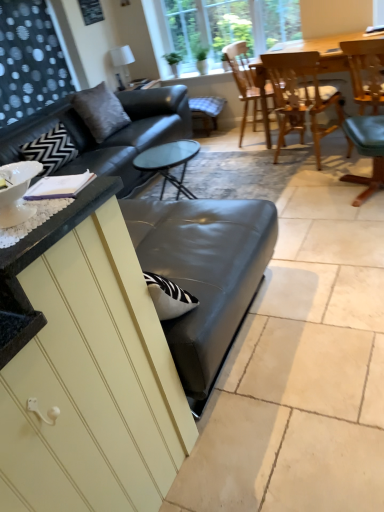
Measure the distance between wooden chair at upper right, which is the 2th chair from right to left, and camera.

9.44 feet.

This screenshot has height=512, width=384. I want to click on checkered fabric bar stool at center, so click(207, 110).

Describe the element at coordinates (229, 27) in the screenshot. I see `clear glass window at upper center` at that location.

You are a GUI agent. You are given a task and a screenshot of the screen. Output one action in this format:
    pyautogui.click(x=<x>, y=<y>)
    Task: Click on the wooden chair at upper right, which ranks as the third chair in left-to-right order
    This screenshot has height=512, width=384.
    Given the screenshot: What is the action you would take?
    pyautogui.click(x=365, y=106)

You are a GUI agent. You are given a task and a screenshot of the screen. Output one action in this format:
    pyautogui.click(x=<x>, y=<y>)
    Task: Click on the wooden chair at upper right, which is the 2th chair from right to left
    
    Given the screenshot: What is the action you would take?
    pyautogui.click(x=301, y=96)

Does clear glass window at upper center come in front of wooden chair at upper right, which is counted as the 2th chair, starting from the left?

That is False.

Is clear glass window at upper center oriented towards wooden chair at upper right, which is the 2th chair from right to left?

Yes, clear glass window at upper center is oriented towards wooden chair at upper right, which is the 2th chair from right to left.

Are clear glass window at upper center and wooden chair at upper right, which is counted as the 2th chair, starting from the left, making contact?

No, clear glass window at upper center is not beside wooden chair at upper right, which is counted as the 2th chair, starting from the left.

From the image's perspective, is clear glass window at upper center on wooden chair at upper right, which is counted as the 2th chair, starting from the left?

Yes.

Considering the positions of point (295, 60) and point (86, 93), is point (295, 60) closer or farther from the camera than point (86, 93)?

Point (295, 60) is closer to the camera than point (86, 93).

In the scene shown: Considering the sizes of wooden chair at upper right, which is counted as the 2th chair, starting from the left, and gray fabric pillow at upper left in the image, is wooden chair at upper right, which is counted as the 2th chair, starting from the left, bigger or smaller than gray fabric pillow at upper left?

Considering their sizes, wooden chair at upper right, which is counted as the 2th chair, starting from the left, takes up more space than gray fabric pillow at upper left.

How distant is wooden chair at upper right, which is counted as the 2th chair, starting from the left, from gray fabric pillow at upper left?

wooden chair at upper right, which is counted as the 2th chair, starting from the left, and gray fabric pillow at upper left are 4.67 feet apart from each other.

Is wooden chair at upper right, which is counted as the 2th chair, starting from the left, closer to camera compared to gray fabric pillow at upper left?

Yes, wooden chair at upper right, which is counted as the 2th chair, starting from the left, is closer to the viewer.

Based on the photo, what's the angular difference between wooden chair at upper center, the first chair when ordered from left to right, and wooden chair at upper right, which is the 2th chair from right to left,'s facing directions?

They differ by 74.1 degrees in their facing directions.

Is wooden chair at upper center, the first chair when ordered from left to right, not within wooden chair at upper right, which is counted as the 2th chair, starting from the left?

Yes.

Considering the sizes of objects wooden chair at upper center, the first chair when ordered from left to right, and wooden chair at upper right, which is counted as the 2th chair, starting from the left, in the image provided, who is thinner, wooden chair at upper center, the first chair when ordered from left to right, or wooden chair at upper right, which is counted as the 2th chair, starting from the left,?

Thinner between the two is wooden chair at upper center, the first chair when ordered from left to right.

Is wooden chair at upper center, which is the third chair in right-to-left order, closer to the viewer compared to wooden chair at upper right, which is the 2th chair from right to left?

No, it is not.

Is wooden chair at upper center, which is the third chair in right-to-left order, oriented away from gray fabric pillow at upper left?

That's not correct — wooden chair at upper center, which is the third chair in right-to-left order, is not looking away from gray fabric pillow at upper left.

From a real-world perspective, is wooden chair at upper center, the first chair when ordered from left to right, physically located above or below gray fabric pillow at upper left?

From a real-world perspective, wooden chair at upper center, the first chair when ordered from left to right, is physically below gray fabric pillow at upper left.

Is wooden chair at upper center, the first chair when ordered from left to right, touching gray fabric pillow at upper left?

There is a gap between wooden chair at upper center, the first chair when ordered from left to right, and gray fabric pillow at upper left.

Between wooden chair at upper center, the first chair when ordered from left to right, and gray fabric pillow at upper left, which one is positioned behind?

wooden chair at upper center, the first chair when ordered from left to right, is further away from the camera.

Does gray fabric pillow at upper left contain wooden chair at upper right, marked as the first chair in a right-to-left arrangement?

Definitely not — wooden chair at upper right, marked as the first chair in a right-to-left arrangement, is not inside gray fabric pillow at upper left.

Considering the relative positions of gray fabric pillow at upper left and wooden chair at upper right, marked as the first chair in a right-to-left arrangement, in the image provided, is gray fabric pillow at upper left to the left or to the right of wooden chair at upper right, marked as the first chair in a right-to-left arrangement,?

gray fabric pillow at upper left is to the left of wooden chair at upper right, marked as the first chair in a right-to-left arrangement.

From a real-world perspective, who is located lower, gray fabric pillow at upper left or wooden chair at upper right, marked as the first chair in a right-to-left arrangement?

wooden chair at upper right, marked as the first chair in a right-to-left arrangement.

Consider the image. Is gray fabric pillow at upper left taller than wooden chair at upper right, which ranks as the third chair in left-to-right order?

No, gray fabric pillow at upper left is not taller than wooden chair at upper right, which ranks as the third chair in left-to-right order.

How many degrees apart are the facing directions of clear glass window at upper center and wooden chair at upper center, which is the third chair in right-to-left order?

87.5 degrees.

The height and width of the screenshot is (512, 384). I want to click on the 1st chair to the right of the clear glass window at upper center, starting your count from the anchor, so click(249, 85).

Is clear glass window at upper center taller or shorter than wooden chair at upper center, the first chair when ordered from left to right?

Clearly, clear glass window at upper center is shorter compared to wooden chair at upper center, the first chair when ordered from left to right.

How distant is clear glass window at upper center from wooden chair at upper center, which is the third chair in right-to-left order?

clear glass window at upper center is 15.62 inches from wooden chair at upper center, which is the third chair in right-to-left order.

Which is more to the left, checkered fabric bar stool at center or wooden chair at upper center, the first chair when ordered from left to right?

checkered fabric bar stool at center.

Is checkered fabric bar stool at center oriented away from wooden chair at upper center, the first chair when ordered from left to right?

No, wooden chair at upper center, the first chair when ordered from left to right, is not at the back of checkered fabric bar stool at center.

Considering the sizes of objects checkered fabric bar stool at center and wooden chair at upper center, which is the third chair in right-to-left order, in the image provided, who is thinner, checkered fabric bar stool at center or wooden chair at upper center, which is the third chair in right-to-left order,?

Thinner between the two is checkered fabric bar stool at center.

At what (x,y) coordinates should I click in order to perform the action: click on window above the wooden chair at upper right, which is counted as the 2th chair, starting from the left (from the image's perspective). Please return your answer as a coordinate pair (x, y). The height and width of the screenshot is (512, 384). Looking at the image, I should click on (229, 27).

Locate an element on the screen. The height and width of the screenshot is (512, 384). pillow on the left of wooden chair at upper right, which is the 2th chair from right to left is located at coordinates 100,111.

Based on their spatial positions, is clear glass window at upper center or checkered fabric bar stool at center further from wooden chair at upper center, the first chair when ordered from left to right?

Among the two, checkered fabric bar stool at center is located further to wooden chair at upper center, the first chair when ordered from left to right.

Considering their positions, is gray fabric pillow at upper left positioned closer to wooden chair at upper right, which ranks as the third chair in left-to-right order, than wooden chair at upper right, which is the 2th chair from right to left?

wooden chair at upper right, which is the 2th chair from right to left, is closer to wooden chair at upper right, which ranks as the third chair in left-to-right order.

Estimate the real-world distances between objects in this image. Which object is closer to wooden chair at upper right, which ranks as the third chair in left-to-right order, clear glass window at upper center or wooden chair at upper center, which is the third chair in right-to-left order?

wooden chair at upper center, which is the third chair in right-to-left order, lies closer to wooden chair at upper right, which ranks as the third chair in left-to-right order, than the other object.

Looking at this image, when comparing their distances from checkered fabric bar stool at center, does wooden chair at upper right, which ranks as the third chair in left-to-right order, or wooden chair at upper right, which is the 2th chair from right to left, seem further?

Among the two, wooden chair at upper right, which ranks as the third chair in left-to-right order, is located further to checkered fabric bar stool at center.

Based on their spatial positions, is checkered fabric bar stool at center or gray fabric pillow at upper left further from wooden chair at upper right, marked as the first chair in a right-to-left arrangement?

The object further to wooden chair at upper right, marked as the first chair in a right-to-left arrangement, is gray fabric pillow at upper left.

Estimate the real-world distances between objects in this image. Which object is further from clear glass window at upper center, gray fabric pillow at upper left or checkered fabric bar stool at center?

gray fabric pillow at upper left.

From the image, which object appears to be farther from wooden chair at upper right, which ranks as the third chair in left-to-right order, checkered fabric bar stool at center or wooden chair at upper right, which is the 2th chair from right to left?

Among the two, checkered fabric bar stool at center is located further to wooden chair at upper right, which ranks as the third chair in left-to-right order.

Estimate the real-world distances between objects in this image. Which object is further from checkered fabric bar stool at center, wooden chair at upper right, marked as the first chair in a right-to-left arrangement, or clear glass window at upper center?

wooden chair at upper right, marked as the first chair in a right-to-left arrangement, is further to checkered fabric bar stool at center.

I want to click on chair located between wooden chair at upper right, which ranks as the third chair in left-to-right order, and wooden chair at upper center, the first chair when ordered from left to right, in the depth direction, so click(301, 96).

Locate an element on the screen. chair between wooden chair at upper right, which is counted as the 2th chair, starting from the left, and checkered fabric bar stool at center from front to back is located at coordinates (249, 85).

Identify the location of chair between gray fabric pillow at upper left and wooden chair at upper right, which is counted as the 2th chair, starting from the left, from left to right. (249, 85).

Identify the location of window between wooden chair at upper right, which is counted as the 2th chair, starting from the left, and checkered fabric bar stool at center from front to back. (229, 27).